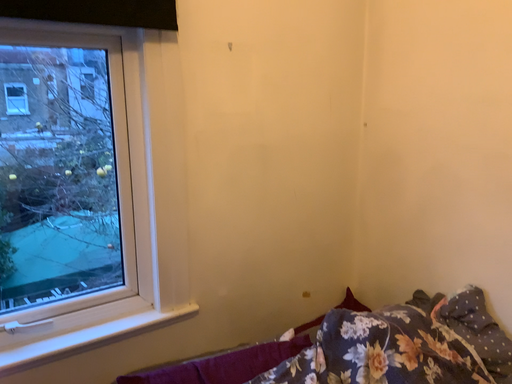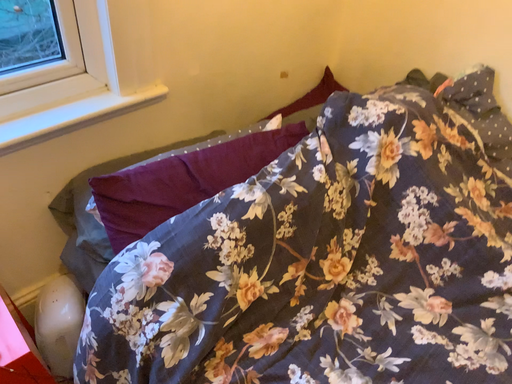
Question: How did the camera likely rotate when shooting the video?

Choices:
 (A) rotated downward
 (B) rotated upward

Answer: (A)